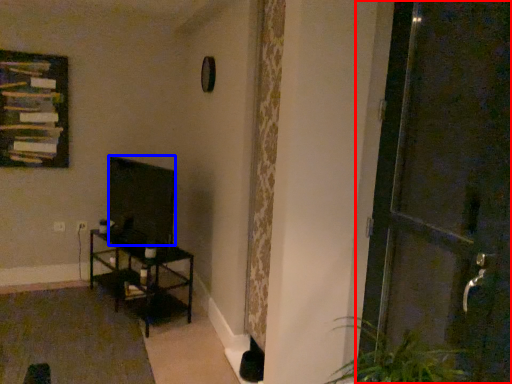
Question: Which object is closer to the camera taking this photo, door (highlighted by a red box) or wide (highlighted by a blue box)?

Choices:
 (A) door
 (B) wide

Answer: (A)